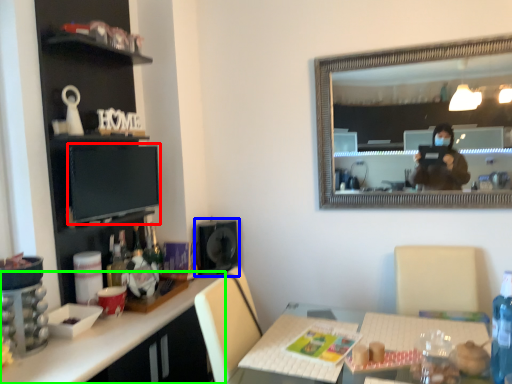
Question: Based on their relative distances, which object is farther from computer monitor (highlighted by a red box)? Choose from speaker (highlighted by a blue box) and desk (highlighted by a green box).

Choices:
 (A) speaker
 (B) desk

Answer: (A)